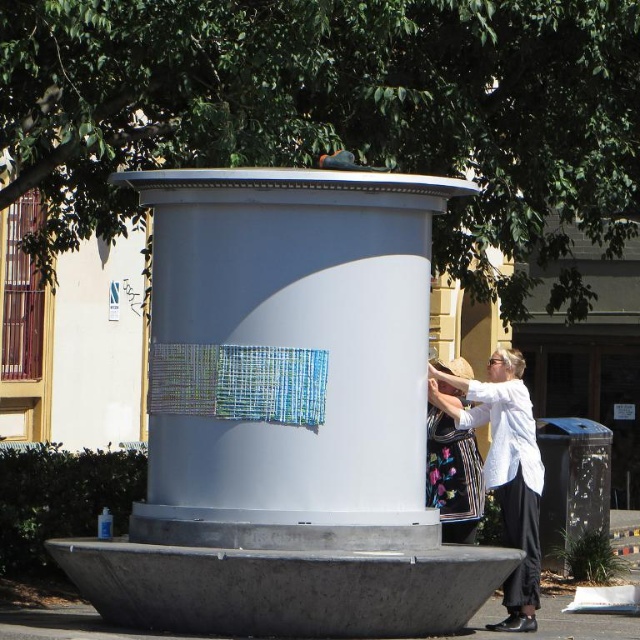
Question: Based on their relative distances, which object is nearer to the white matte fountain at center?

Choices:
 (A) white cotton shirt at center
 (B) floral fabric bag at lower right

Answer: (B)

Question: Is white matte fountain at center further to the viewer compared to floral fabric bag at lower right?

Choices:
 (A) no
 (B) yes

Answer: (A)

Question: Does white matte fountain at center appear under white cotton shirt at center?

Choices:
 (A) yes
 (B) no

Answer: (B)

Question: Which object appears farthest from the camera in this image?

Choices:
 (A) white matte fountain at center
 (B) white cotton shirt at center
 (C) floral fabric bag at lower right

Answer: (C)

Question: Observing the image, what is the correct spatial positioning of white matte fountain at center in reference to white cotton shirt at center?

Choices:
 (A) below
 (B) above

Answer: (B)

Question: Which point is closer to the camera?

Choices:
 (A) white cotton shirt at center
 (B) white matte fountain at center
 (C) floral fabric bag at lower right

Answer: (B)